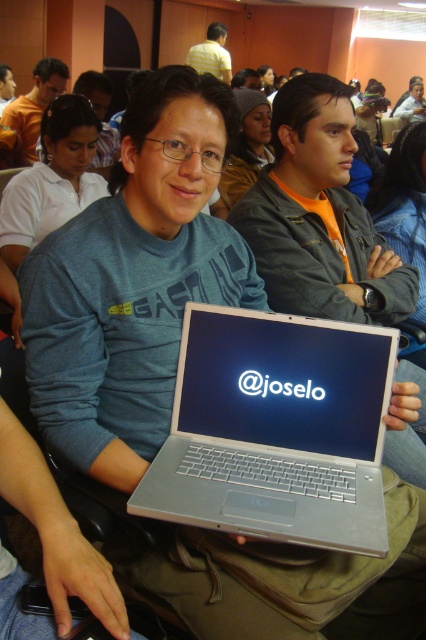
Does point (178, 500) lie behind point (28, 122)?

No, (178, 500) is closer to viewer.

Is silver metallic laptop at center to the right of matte gray shirt at center from the viewer's perspective?

Yes, silver metallic laptop at center is to the right of matte gray shirt at center.

Between point (308, 531) and point (8, 115), which one is positioned in front?

Point (308, 531)

Locate an element on the screen. silver metallic laptop at center is located at coordinates (276, 429).

Which is above, matte gray jacket at center or yellow shirt at upper center?

Positioned higher is yellow shirt at upper center.

Is point (307, 109) positioned after point (199, 65)?

No, (307, 109) is in front of (199, 65).

Between point (259, 220) and point (199, 51), which one is positioned in front?

Point (259, 220) is in front.

Locate an element on the screen. The image size is (426, 640). matte gray jacket at center is located at coordinates (319, 216).

Does matte gray jacket at center appear under matte black laptop at center?

Yes.

Which is behind, point (405, 280) or point (11, 88)?

Point (11, 88)

Does point (324, 209) lie in front of point (11, 97)?

That is True.

Image resolution: width=426 pixels, height=640 pixels. In order to click on matte gray jacket at center in this screenshot , I will do `click(319, 216)`.